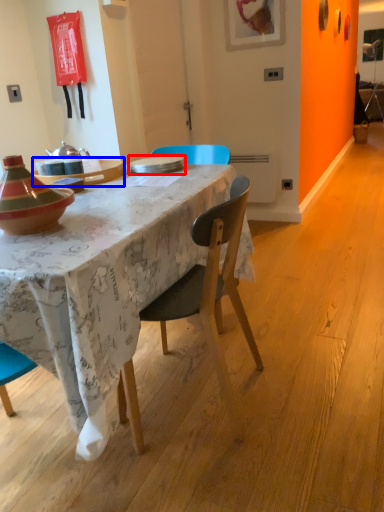
Question: Among these objects, which one is farthest to the camera, plate (highlighted by a red box) or table (highlighted by a blue box)?

Choices:
 (A) plate
 (B) table

Answer: (A)